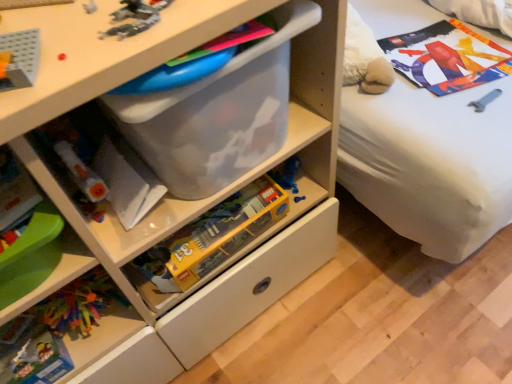
You are a GUI agent. You are given a task and a screenshot of the screen. Output one action in this format:
    pyautogui.click(x=<x>, y=<y>)
    Task: Click on the blank space situated above translucent plastic lego box at center, the second toy when ordered from top to bottom (from a real-world perspective)
    
    Given the screenshot: What is the action you would take?
    pyautogui.click(x=211, y=218)